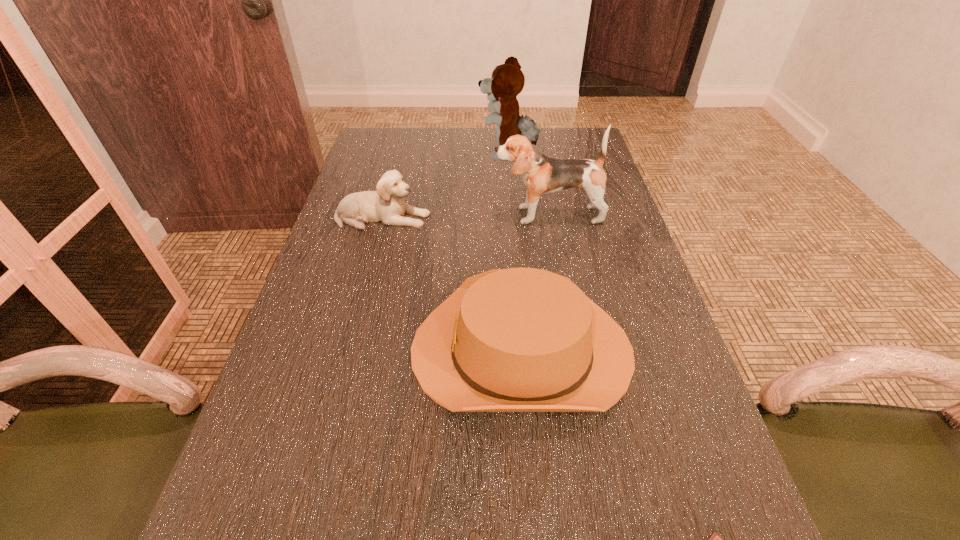
Where is `free space between the shortest puppy and the farthest puppy`? The image size is (960, 540). free space between the shortest puppy and the farthest puppy is located at coordinates (445, 186).

Locate an element on the screen. This screenshot has width=960, height=540. object that is the second closest to the shortest object is located at coordinates (542, 175).

Select which object is the third closest to the shortest object. Please provide its 2D coordinates. Your answer should be formatted as a tuple, i.e. [(x, y)], where the tuple contains the x and y coordinates of a point satisfying the conditions above.

[(387, 205)]

Point out which puppy is positioned as the second nearest to the cowboy hat. Please provide its 2D coordinates. Your answer should be formatted as a tuple, i.e. [(x, y)], where the tuple contains the x and y coordinates of a point satisfying the conditions above.

[(542, 175)]

Locate an element on the screen. puppy that is the second closest one to the leftmost puppy is located at coordinates (507, 80).